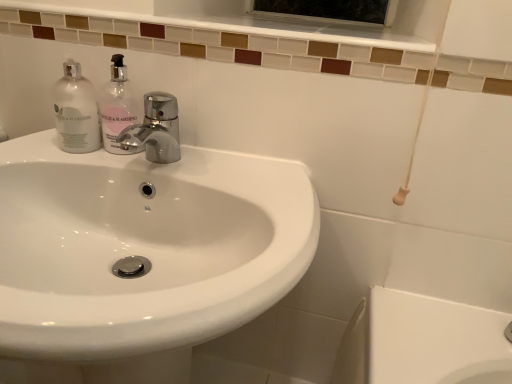
The height and width of the screenshot is (384, 512). What do you see at coordinates (76, 111) in the screenshot? I see `clear glass bottle at left` at bounding box center [76, 111].

The image size is (512, 384). I want to click on white glossy sink at center, so click(140, 255).

The image size is (512, 384). Identify the location of translucent glass soap dispenser at upper left. (117, 107).

Identify the location of clear glass bottle at left. The width and height of the screenshot is (512, 384). (76, 111).

Consider the image. Considering the sizes of objects clear glass bottle at left and white glossy sink at center in the image provided, who is bigger, clear glass bottle at left or white glossy sink at center?

white glossy sink at center is bigger.

You are a GUI agent. You are given a task and a screenshot of the screen. Output one action in this format:
    pyautogui.click(x=<x>, y=<y>)
    Task: Click on the sink beneath the clear glass bottle at left (from a real-world perspective)
    The height and width of the screenshot is (384, 512).
    Given the screenshot: What is the action you would take?
    pyautogui.click(x=140, y=255)

Between clear glass bottle at left and white glossy sink at center, which one has less height?

clear glass bottle at left.

From the image's perspective, between clear glass bottle at left and white glossy sink at center, who is located below?

From the image's view, white glossy sink at center is below.

Is white glossy sink at center far from clear glass bottle at left?

Actually, white glossy sink at center and clear glass bottle at left are a little close together.

In the scene shown: From the image's perspective, does white glossy sink at center appear lower than clear glass bottle at left?

Correct, white glossy sink at center appears lower than clear glass bottle at left in the image.

Is white glossy sink at center wider or thinner than clear glass bottle at left?

white glossy sink at center is wider than clear glass bottle at left.

Does white glossy sink at center appear on the left side of clear glass bottle at left?

No.

Is translucent glass soap dispenser at upper left inside or outside of clear glass bottle at left?

translucent glass soap dispenser at upper left lies outside clear glass bottle at left.

How far apart are translucent glass soap dispenser at upper left and clear glass bottle at left?

translucent glass soap dispenser at upper left and clear glass bottle at left are 4.92 centimeters apart from each other.

Considering the relative sizes of translucent glass soap dispenser at upper left and clear glass bottle at left in the image provided, is translucent glass soap dispenser at upper left thinner than clear glass bottle at left?

Correct, the width of translucent glass soap dispenser at upper left is less than that of clear glass bottle at left.

From the image's perspective, does translucent glass soap dispenser at upper left appear lower than clear glass bottle at left?

No, from the image's perspective, translucent glass soap dispenser at upper left is not below clear glass bottle at left.

In the image, is translucent glass soap dispenser at upper left on the left side or the right side of white glossy sink at center?

Clearly, translucent glass soap dispenser at upper left is on the right of white glossy sink at center in the image.

From a real-world perspective, between translucent glass soap dispenser at upper left and white glossy sink at center, who is vertically higher?

translucent glass soap dispenser at upper left is physically above.

Is translucent glass soap dispenser at upper left outside of white glossy sink at center?

Yes.

Find the location of `sink on the left side of translucent glass soap dispenser at upper left`. sink on the left side of translucent glass soap dispenser at upper left is located at coordinates (140, 255).

Between white glossy sink at center and translucent glass soap dispenser at upper left, which one is positioned behind?

translucent glass soap dispenser at upper left is behind.

From a real-world perspective, is white glossy sink at center located higher than translucent glass soap dispenser at upper left?

Actually, white glossy sink at center is physically below translucent glass soap dispenser at upper left in the real world.

Does point (79, 346) come in front of point (112, 146)?

Yes, it is.

Are white glossy sink at center and translucent glass soap dispenser at upper left beside each other?

No, white glossy sink at center is not making contact with translucent glass soap dispenser at upper left.

Looking at the image, does clear glass bottle at left seem bigger or smaller compared to translucent glass soap dispenser at upper left?

In the image, clear glass bottle at left appears to be larger than translucent glass soap dispenser at upper left.

Measure the distance between clear glass bottle at left and translucent glass soap dispenser at upper left.

A distance of 1.94 inches exists between clear glass bottle at left and translucent glass soap dispenser at upper left.

From the image's perspective, would you say clear glass bottle at left is shown under translucent glass soap dispenser at upper left?

Yes, from the image's perspective, clear glass bottle at left is below translucent glass soap dispenser at upper left.

Is the position of clear glass bottle at left less distant than that of translucent glass soap dispenser at upper left?

No, clear glass bottle at left is further to the viewer.

What are the coordinates of `cleaning product behind the white glossy sink at center` in the screenshot? It's located at (76, 111).

Locate an element on the screen. The width and height of the screenshot is (512, 384). cleaning product above the white glossy sink at center (from the image's perspective) is located at coordinates (76, 111).

Considering their positions, is translucent glass soap dispenser at upper left positioned further to clear glass bottle at left than white glossy sink at center?

white glossy sink at center lies further to clear glass bottle at left than the other object.

Considering their positions, is white glossy sink at center positioned closer to clear glass bottle at left than translucent glass soap dispenser at upper left?

translucent glass soap dispenser at upper left is positioned closer to the anchor clear glass bottle at left.

Considering their positions, is clear glass bottle at left positioned closer to white glossy sink at center than translucent glass soap dispenser at upper left?

translucent glass soap dispenser at upper left is closer to white glossy sink at center.

Based on the photo, based on their spatial positions, is white glossy sink at center or clear glass bottle at left closer to translucent glass soap dispenser at upper left?

clear glass bottle at left is positioned closer to the anchor translucent glass soap dispenser at upper left.

Which object lies nearer to the anchor point white glossy sink at center, translucent glass soap dispenser at upper left or clear glass bottle at left?

Based on the image, translucent glass soap dispenser at upper left appears to be nearer to white glossy sink at center.

Considering their positions, is clear glass bottle at left positioned further to translucent glass soap dispenser at upper left than white glossy sink at center?

white glossy sink at center is further to translucent glass soap dispenser at upper left.

At what (x,y) coordinates should I click in order to perform the action: click on cleaning product between translucent glass soap dispenser at upper left and white glossy sink at center in the vertical direction. Please return your answer as a coordinate pair (x, y). Looking at the image, I should click on (76, 111).